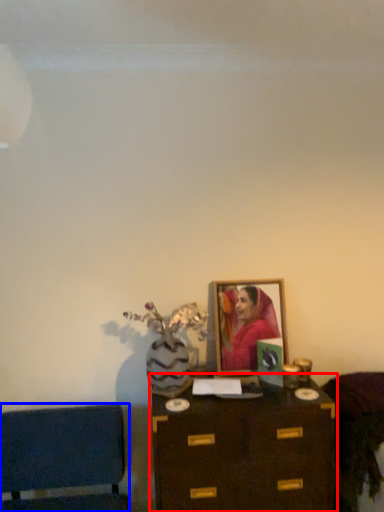
Question: Which object appears farthest to the camera in this image, table (highlighted by a red box) or furniture (highlighted by a blue box)?

Choices:
 (A) table
 (B) furniture

Answer: (A)